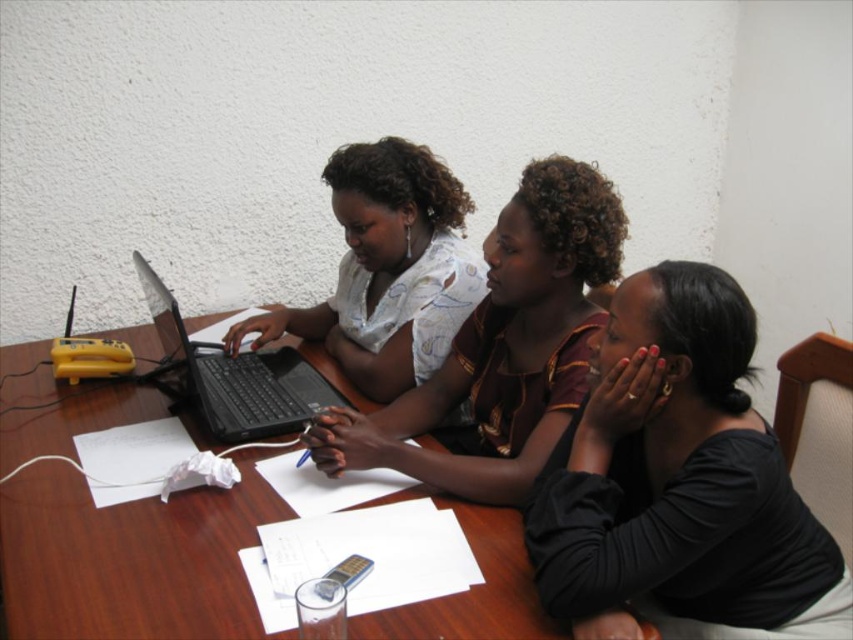
Question: Can you confirm if wooden table at center is bigger than matte white shirt at center?

Choices:
 (A) yes
 (B) no

Answer: (A)

Question: Which point is closer to the camera?

Choices:
 (A) (503, 461)
 (B) (822, 528)
 (C) (231, 422)

Answer: (B)

Question: Is wooden table at center positioned behind matte white blouse at center?

Choices:
 (A) no
 (B) yes

Answer: (A)

Question: Does black matte shirt at lower right appear on the right side of matte white shirt at center?

Choices:
 (A) yes
 (B) no

Answer: (A)

Question: Which of the following is the closest to the observer?

Choices:
 (A) wooden table at center
 (B) matte white shirt at center
 (C) matte white blouse at center
 (D) black plastic laptop at left

Answer: (A)

Question: Which object is positioned closest to the black matte shirt at lower right?

Choices:
 (A) matte white blouse at center
 (B) matte white shirt at center

Answer: (A)